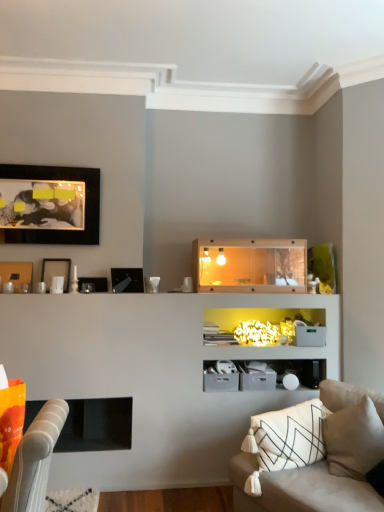
Image resolution: width=384 pixels, height=512 pixels. What do you see at coordinates (249, 266) in the screenshot?
I see `wooden shelf at center` at bounding box center [249, 266].

Identify the location of wooden shelf at center. (249, 266).

You are a GUI agent. You are given a task and a screenshot of the screen. Output one action in this format:
    pyautogui.click(x=<x>, y=<y>)
    Task: Click on the metallic black picture frame at upper left, the 2th picture frame when ordered from bottom to top
    The width and height of the screenshot is (384, 512).
    Given the screenshot: What is the action you would take?
    pyautogui.click(x=127, y=280)

Locate an element on the screen. Image resolution: width=384 pixels, height=512 pixels. white soft pillow at lower right is located at coordinates (354, 439).

What do you see at coordinates (354, 439) in the screenshot? I see `white soft pillow at lower right` at bounding box center [354, 439].

Locate an element on the screen. beige fabric couch at lower right is located at coordinates tap(309, 455).

Which is more to the right, white matte picture frame at upper left, which is the second picture frame from top to bottom, or metallic black picture frame at upper left, the 3th picture frame positioned from the top?

Positioned to the right is metallic black picture frame at upper left, the 3th picture frame positioned from the top.

Considering the sizes of objects white matte picture frame at upper left, which is the second picture frame from top to bottom, and metallic black picture frame at upper left, the 2th picture frame when ordered from bottom to top, in the image provided, who is taller, white matte picture frame at upper left, which is the second picture frame from top to bottom, or metallic black picture frame at upper left, the 2th picture frame when ordered from bottom to top,?

With more height is white matte picture frame at upper left, which is the second picture frame from top to bottom.

Does point (48, 267) come in front of point (124, 271)?

Yes, point (48, 267) is closer to viewer.

Based on the photo, considering the sizes of objects white matte picture frame at upper left, which is the second picture frame from top to bottom, and metallic black picture frame at upper left, the 3th picture frame positioned from the top, in the image provided, who is bigger, white matte picture frame at upper left, which is the second picture frame from top to bottom, or metallic black picture frame at upper left, the 3th picture frame positioned from the top,?

Bigger between the two is metallic black picture frame at upper left, the 3th picture frame positioned from the top.

From a real-world perspective, which object stands above the other?

From a 3D spatial view, white soft pillow at lower right is above.

Does white soft pillow at lower right have a greater height compared to beige fabric couch at lower right?

No, white soft pillow at lower right is not taller than beige fabric couch at lower right.

Looking at this image, how many degrees apart are the facing directions of white soft pillow at lower right and beige fabric couch at lower right?

4.58 degrees separate the facing orientations of white soft pillow at lower right and beige fabric couch at lower right.

From the image's perspective, which one is positioned higher, white soft pillow at lower right or beige fabric couch at lower right?

white soft pillow at lower right, from the image's perspective.

From the image's perspective, is metallic black picture frame at upper left, the 2th picture frame when ordered from bottom to top, located above wooden shelf at center?

No, from the image's perspective, metallic black picture frame at upper left, the 2th picture frame when ordered from bottom to top, is not above wooden shelf at center.

This screenshot has height=512, width=384. I want to click on shelf above the metallic black picture frame at upper left, the 2th picture frame when ordered from bottom to top (from a real-world perspective), so coord(249,266).

Looking at this image, is metallic black picture frame at upper left, the 2th picture frame when ordered from bottom to top, at the right side of wooden shelf at center?

No.

Considering the sizes of objects metallic black picture frame at upper left, the 2th picture frame when ordered from bottom to top, and wooden shelf at center in the image provided, who is thinner, metallic black picture frame at upper left, the 2th picture frame when ordered from bottom to top, or wooden shelf at center?

metallic black picture frame at upper left, the 2th picture frame when ordered from bottom to top, is thinner.

Is point (44, 190) in front of point (84, 428)?

That is True.

Considering the sizes of matte black picture frame at upper left, arranged as the 1th picture frame when viewed from the top, and black matte fireplace at lower left in the image, is matte black picture frame at upper left, arranged as the 1th picture frame when viewed from the top, wider or thinner than black matte fireplace at lower left?

matte black picture frame at upper left, arranged as the 1th picture frame when viewed from the top, is thinner than black matte fireplace at lower left.

From the picture: Between matte black picture frame at upper left, arranged as the 1th picture frame when viewed from the top, and black matte fireplace at lower left, which one has less height?

Standing shorter between the two is black matte fireplace at lower left.

Is matte black picture frame at upper left, the fourth picture frame from the bottom, positioned before black matte fireplace at lower left?

That is False.

From the picture: Is black matte fireplace at lower left facing away from beige fabric couch at lower right?

No, black matte fireplace at lower left is not facing the opposite direction of beige fabric couch at lower right.

From the picture: From a real-world perspective, which object rests below the other?

beige fabric couch at lower right, from a real-world perspective.

Based on the photo, is beige fabric couch at lower right completely or partially inside black matte fireplace at lower left?

No, black matte fireplace at lower left does not contain beige fabric couch at lower right.

In order to click on studio couch beneath the white matte picture frame at upper left, the 3th picture frame in the bottom-to-top sequence (from a real-world perspective) in this screenshot , I will do `click(309, 455)`.

From a real-world perspective, is white matte picture frame at upper left, which is the second picture frame from top to bottom, above or below beige fabric couch at lower right?

Clearly, from a real-world perspective, white matte picture frame at upper left, which is the second picture frame from top to bottom, is above beige fabric couch at lower right.

Is white matte picture frame at upper left, which is the second picture frame from top to bottom, aimed at beige fabric couch at lower right?

No, white matte picture frame at upper left, which is the second picture frame from top to bottom, is not aimed at beige fabric couch at lower right.

Which of these two, white matte picture frame at upper left, which is the second picture frame from top to bottom, or beige fabric couch at lower right, is wider?

beige fabric couch at lower right is wider.

Is metallic black picture frame at upper left, the 2th picture frame when ordered from bottom to top, not within white soft pillow at lower right?

That's correct, metallic black picture frame at upper left, the 2th picture frame when ordered from bottom to top, is outside of white soft pillow at lower right.

Could you tell me if metallic black picture frame at upper left, the 3th picture frame positioned from the top, is facing white soft pillow at lower right?

No, metallic black picture frame at upper left, the 3th picture frame positioned from the top, is not aimed at white soft pillow at lower right.

Can you confirm if metallic black picture frame at upper left, the 2th picture frame when ordered from bottom to top, is positioned to the left of white soft pillow at lower right?

Correct, you'll find metallic black picture frame at upper left, the 2th picture frame when ordered from bottom to top, to the left of white soft pillow at lower right.

Is metallic black picture frame at upper left, the 3th picture frame positioned from the top, positioned behind white soft pillow at lower right?

Yes, metallic black picture frame at upper left, the 3th picture frame positioned from the top, is further from the viewer.

Locate an element on the screen. This screenshot has width=384, height=512. the 2nd picture frame behind the metallic black picture frame at upper left, the 2th picture frame when ordered from bottom to top is located at coordinates (56, 271).

You are a GUI agent. You are given a task and a screenshot of the screen. Output one action in this format:
    pyautogui.click(x=<x>, y=<y>)
    Task: Click on the studio couch below the white soft pillow at lower right (from the image's perspective)
    
    Given the screenshot: What is the action you would take?
    pyautogui.click(x=309, y=455)

Which object lies further to the anchor point black matte fireplace at lower left, wooden shelf at center or matte black picture frame at upper left, the fourth picture frame from the bottom?

matte black picture frame at upper left, the fourth picture frame from the bottom, lies further to black matte fireplace at lower left than the other object.

Consider the image. Considering their positions, is wooden shelf at center positioned closer to matte black picture frame at upper left, the fourth picture frame from the bottom, than beige fabric couch at lower right?

wooden shelf at center.

Looking at the image, which one is located further to white soft pillow at lower right, beige fabric couch at lower right or white matte picture frame at upper left, the 3th picture frame in the bottom-to-top sequence?

white matte picture frame at upper left, the 3th picture frame in the bottom-to-top sequence, is further to white soft pillow at lower right.

Based on their spatial positions, is black matte fireplace at lower left or white matte picture frame at upper left, which is the second picture frame from top to bottom, closer to matte black picture frame at upper left, arranged as the 1th picture frame when viewed from the top?

white matte picture frame at upper left, which is the second picture frame from top to bottom, lies closer to matte black picture frame at upper left, arranged as the 1th picture frame when viewed from the top, than the other object.

Consider the image. Based on their spatial positions, is white soft pillow at lower right or white matte picture frame at upper left, the 3th picture frame in the bottom-to-top sequence, further from black matte fireplace at lower left?

white soft pillow at lower right lies further to black matte fireplace at lower left than the other object.

Considering their positions, is wooden shelf at center positioned further to white matte picture frame at upper left, which is the second picture frame from top to bottom, than metallic black picture frame at upper left, the 3th picture frame positioned from the top?

The object further to white matte picture frame at upper left, which is the second picture frame from top to bottom, is wooden shelf at center.

Estimate the real-world distances between objects in this image. Which object is further from white matte picture frame at upper left, the 3th picture frame in the bottom-to-top sequence, matte black picture frame at upper left, positioned as the fourth picture frame in top-to-bottom order, or white soft pillow at lower right?

Among the two, white soft pillow at lower right is located further to white matte picture frame at upper left, the 3th picture frame in the bottom-to-top sequence.

Which object lies nearer to the anchor point black matte fireplace at lower left, beige fabric couch at lower right or metallic black picture frame at upper left, the 2th picture frame when ordered from bottom to top?

metallic black picture frame at upper left, the 2th picture frame when ordered from bottom to top, is closer to black matte fireplace at lower left.

The height and width of the screenshot is (512, 384). Identify the location of shelf between matte black picture frame at upper left, the first picture frame positioned from the bottom, and white soft pillow at lower right from left to right. (249, 266).

Image resolution: width=384 pixels, height=512 pixels. I want to click on shelf located between white matte picture frame at upper left, the 3th picture frame in the bottom-to-top sequence, and white soft pillow at lower right in the left-right direction, so click(249, 266).

Locate an element on the screen. The width and height of the screenshot is (384, 512). shelf between matte black picture frame at upper left, the fourth picture frame from the bottom, and white soft pillow at lower right, in the horizontal direction is located at coordinates (249, 266).

In order to click on shelf positioned between beige fabric couch at lower right and matte black picture frame at upper left, positioned as the fourth picture frame in top-to-bottom order, from near to far in this screenshot , I will do `click(249, 266)`.